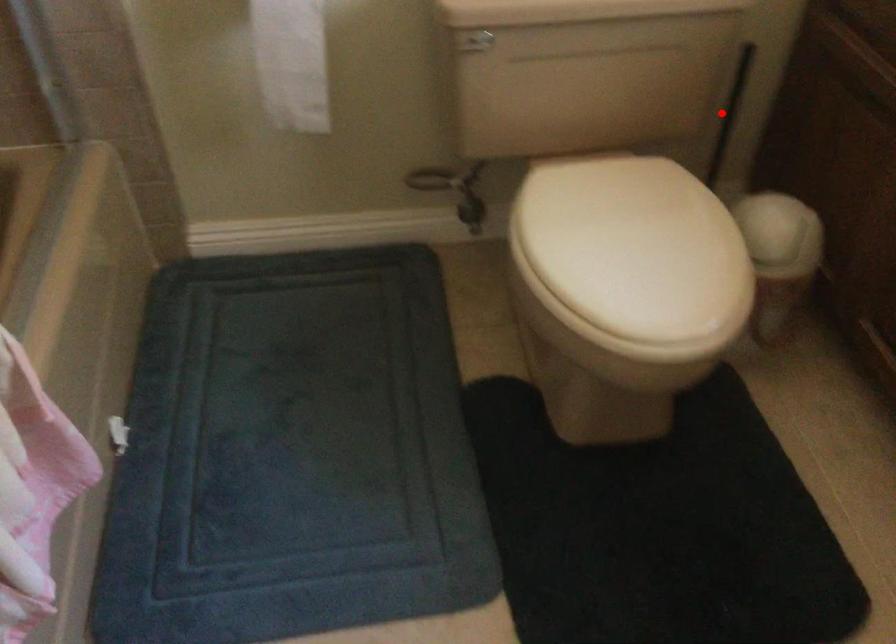
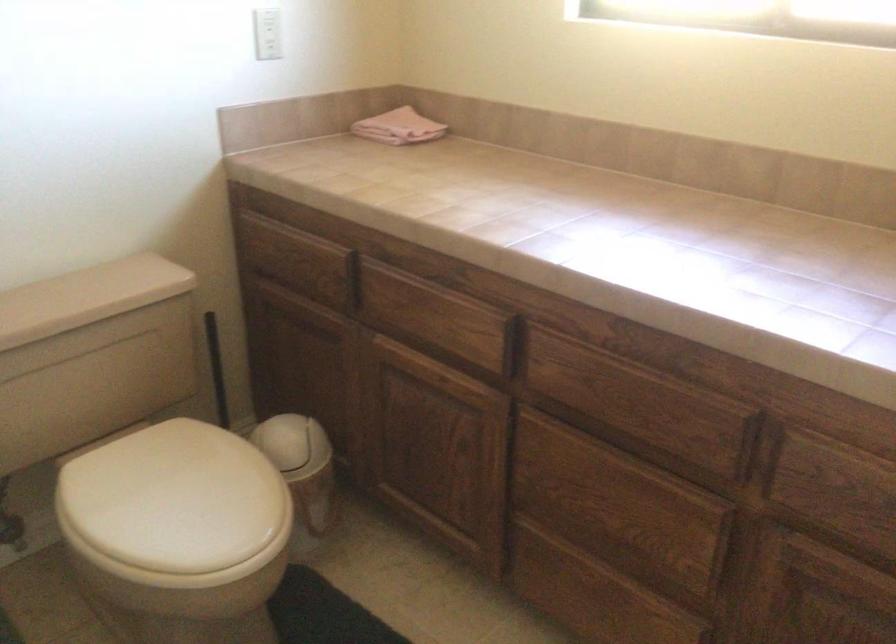
Question: A red point is marked in image1. In image2, is the corresponding 3D point closer to the camera or farther? Reply with the corresponding letter.

Choices:
 (A) The corresponding 3D point is closer.
 (B) The corresponding 3D point is farther.

Answer: (B)